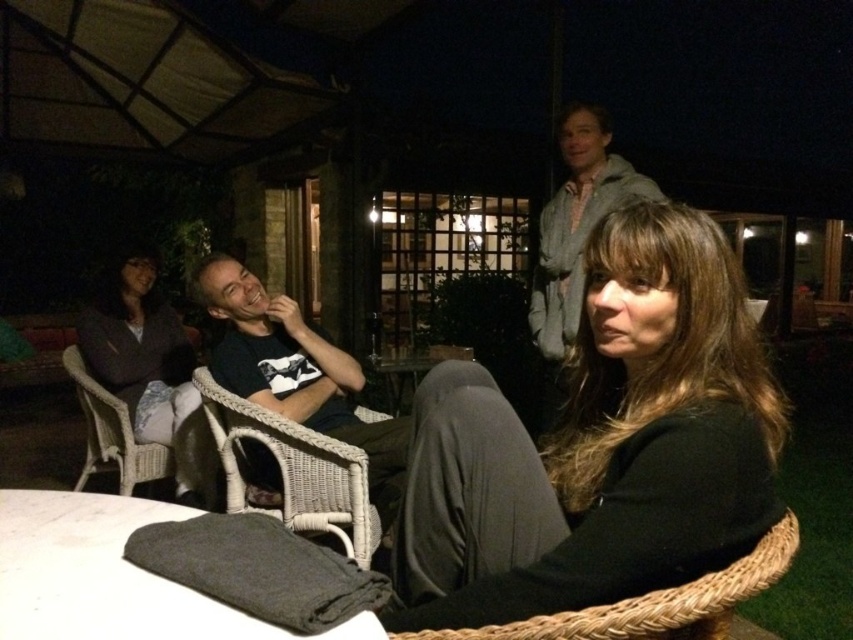
Question: Which point is closer to the camera taking this photo?

Choices:
 (A) (115, 428)
 (B) (125, 376)

Answer: (A)

Question: Which object is positioned farthest from the black matte jacket at center?

Choices:
 (A) gray fabric at lower center
 (B) dark blue t-shirt at center
 (C) wicker chair at left
 (D) white wicker chair at center

Answer: (C)

Question: Where is black matte jacket at center located in relation to gray fabric at lower center in the image?

Choices:
 (A) right
 (B) left

Answer: (A)

Question: Which object is farther from the camera taking this photo?

Choices:
 (A) dark gray fabric jacket at left
 (B) gray fabric at lower center

Answer: (A)

Question: Considering the relative positions of black matte jacket at center and dark blue t-shirt at center in the image provided, where is black matte jacket at center located with respect to dark blue t-shirt at center?

Choices:
 (A) below
 (B) above

Answer: (B)

Question: Does dark gray fabric jacket at left appear on the left side of wicker chair at left?

Choices:
 (A) yes
 (B) no

Answer: (B)